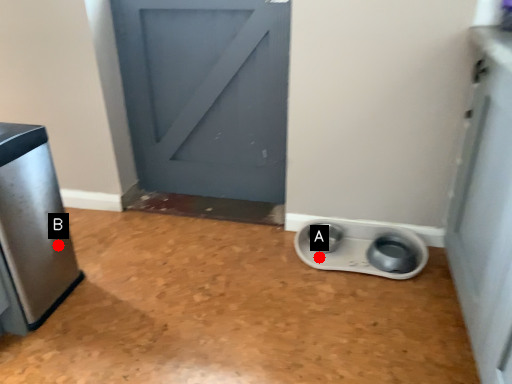
Question: Two points are circled on the image, labeled by A and B beside each circle. Among these points, which one is nearest to the camera?

Choices:
 (A) A is closer
 (B) B is closer

Answer: (B)